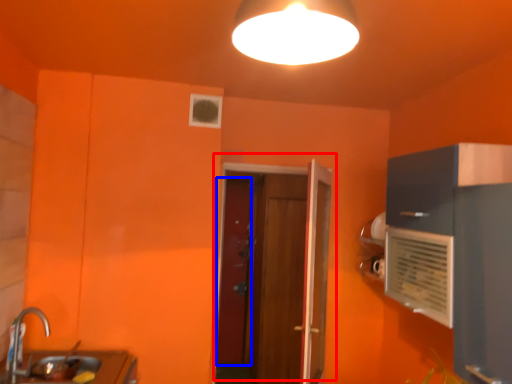
Question: Which of the following is the farthest to the observer, door (highlighted by a red box) or door (highlighted by a blue box)?

Choices:
 (A) door
 (B) door

Answer: (B)